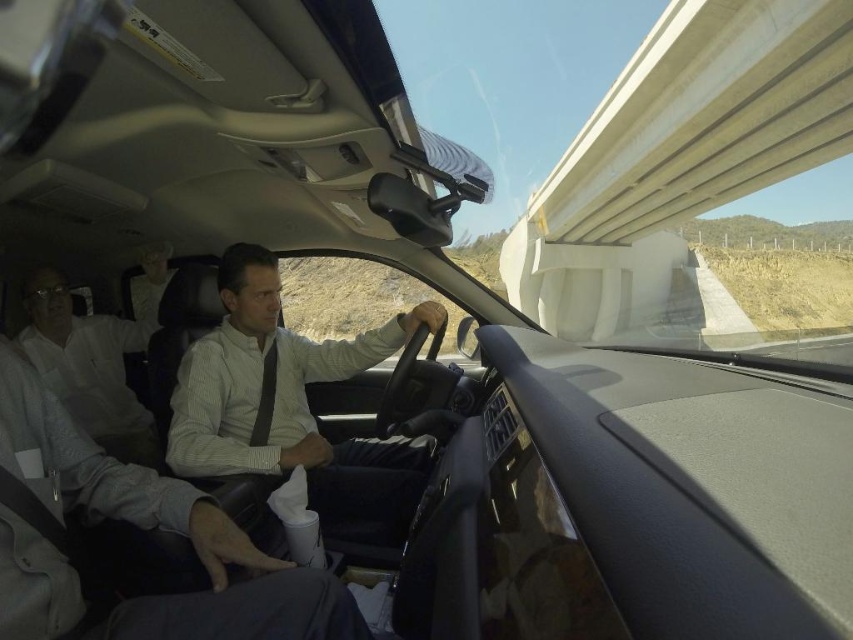
Question: Can you confirm if white striped shirt at center is positioned to the right of white shirt at left?

Choices:
 (A) no
 (B) yes

Answer: (B)

Question: Among these points, which one is nearest to the camera?

Choices:
 (A) (78, 356)
 (B) (276, 349)

Answer: (B)

Question: Can you confirm if white striped shirt at center is bigger than white shirt at left?

Choices:
 (A) no
 (B) yes

Answer: (B)

Question: Is white striped shirt at center bigger than white shirt at left?

Choices:
 (A) yes
 (B) no

Answer: (A)

Question: Which object appears farthest from the camera in this image?

Choices:
 (A) matte black tie at center
 (B) white shirt at left
 (C) white striped shirt at center

Answer: (B)

Question: Which object is farther from the camera taking this photo?

Choices:
 (A) white striped shirt at center
 (B) matte black tie at center

Answer: (B)